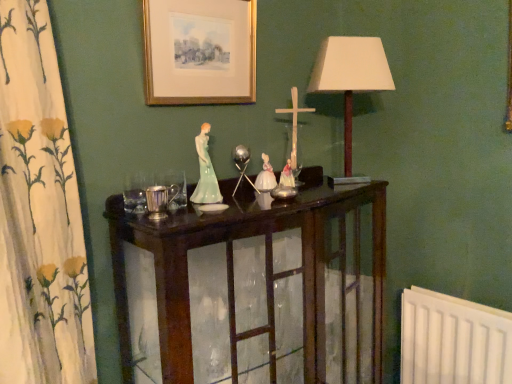
What is the approximate width of dark wood cabinet at center?

dark wood cabinet at center is 15.45 inches in width.

What is the approximate height of silver metallic candle holder at center?

3.18 inches.

Where is `gold-framed print at upper center`? gold-framed print at upper center is located at coordinates (200, 51).

This screenshot has height=384, width=512. Describe the element at coordinates (350, 76) in the screenshot. I see `white fabric lampshade at upper right` at that location.

In order to click on dark wood cabinet at center in this screenshot , I will do `click(265, 269)`.

Looking at their sizes, would you say gold-framed print at upper center is wider or thinner than dark wood cabinet at center?

Considering their sizes, gold-framed print at upper center looks slimmer than dark wood cabinet at center.

Are gold-framed print at upper center and dark wood cabinet at center located far from each other?

Actually, gold-framed print at upper center and dark wood cabinet at center are a little close together.

Is point (226, 39) closer or farther from the camera than point (186, 335)?

Point (226, 39) is positioned farther from the camera compared to point (186, 335).

Can you tell me how much gold-framed print at upper center and white fabric lampshade at upper right differ in facing direction?

They differ by 36 degrees in their facing directions.

Is gold-framed print at upper center inside the boundaries of white fabric lampshade at upper right, or outside?

gold-framed print at upper center is not inside white fabric lampshade at upper right, it's outside.

Is point (189, 40) more distant than point (385, 86)?

No.

From a real-world perspective, which object stands above the other?

gold-framed print at upper center is physically above.

Is dark wood cabinet at center not close to gold-framed print at upper center?

No, dark wood cabinet at center is in close proximity to gold-framed print at upper center.

Is dark wood cabinet at center oriented towards gold-framed print at upper center?

No, dark wood cabinet at center is not turned towards gold-framed print at upper center.

Can you confirm if dark wood cabinet at center is thinner than gold-framed print at upper center?

No, dark wood cabinet at center is not thinner than gold-framed print at upper center.

Consider the image. From the image's perspective, would you say dark wood cabinet at center is positioned over gold-framed print at upper center?

No, from the image's perspective, dark wood cabinet at center is not on top of gold-framed print at upper center.

Is point (377, 239) more distant than point (162, 214)?

That is True.

Considering the sizes of dark wood cabinet at center and silver metallic candle holder at center in the image, is dark wood cabinet at center bigger or smaller than silver metallic candle holder at center?

dark wood cabinet at center is bigger than silver metallic candle holder at center.

Based on the photo, between dark wood cabinet at center and silver metallic candle holder at center, which one appears on the left side from the viewer's perspective?

Positioned to the left is silver metallic candle holder at center.

Based on the photo, considering the sizes of dark wood cabinet at center and silver metallic candle holder at center in the image, is dark wood cabinet at center taller or shorter than silver metallic candle holder at center?

Considering their sizes, dark wood cabinet at center has more height than silver metallic candle holder at center.

How different are the orientations of silver metallic candle holder at center and gold-framed print at upper center in degrees?

The facing directions of silver metallic candle holder at center and gold-framed print at upper center are 0.589 degrees apart.

You are a GUI agent. You are given a task and a screenshot of the screen. Output one action in this format:
    pyautogui.click(x=<x>, y=<y>)
    Task: Click on the candle holder below the gold-framed print at upper center (from a real-world perspective)
    The height and width of the screenshot is (384, 512).
    Given the screenshot: What is the action you would take?
    pyautogui.click(x=160, y=200)

Is silver metallic candle holder at center bigger than gold-framed print at upper center?

No, silver metallic candle holder at center is not bigger than gold-framed print at upper center.

Is silver metallic candle holder at center in front of gold-framed print at upper center?

Yes, silver metallic candle holder at center is closer to the viewer.

Does gold-framed print at upper center turn towards silver metallic candle holder at center?

No, gold-framed print at upper center does not turn towards silver metallic candle holder at center.

In the scene shown: Would you say gold-framed print at upper center is inside or outside silver metallic candle holder at center?

gold-framed print at upper center cannot be found inside silver metallic candle holder at center.

Consider the image. From a real-world perspective, relative to gold-framed print at upper center, is white fabric lampshade at upper right vertically above or below?

In terms of real-world spatial position, white fabric lampshade at upper right is below gold-framed print at upper center.

Considering the sizes of objects white fabric lampshade at upper right and gold-framed print at upper center in the image provided, who is shorter, white fabric lampshade at upper right or gold-framed print at upper center?

With less height is gold-framed print at upper center.

Identify the location of table lamp behind the gold-framed print at upper center. The image size is (512, 384). (350, 76).

From the image's perspective, is white fabric lampshade at upper right on top of gold-framed print at upper center?

No, from the image's perspective, white fabric lampshade at upper right is not on top of gold-framed print at upper center.

I want to click on picture frame above the dark wood cabinet at center (from the image's perspective), so click(x=200, y=51).

Locate an element on the screen. The width and height of the screenshot is (512, 384). picture frame lying on the left of white fabric lampshade at upper right is located at coordinates (200, 51).

When comparing their distances from gold-framed print at upper center, does white fabric lampshade at upper right or silver metallic candle holder at center seem further?

silver metallic candle holder at center is further to gold-framed print at upper center.

Based on their spatial positions, is dark wood cabinet at center or silver metallic candle holder at center closer to gold-framed print at upper center?

silver metallic candle holder at center.

When comparing their distances from dark wood cabinet at center, does silver metallic candle holder at center or gold-framed print at upper center seem closer?

Among the two, silver metallic candle holder at center is located nearer to dark wood cabinet at center.

Based on their spatial positions, is dark wood cabinet at center or white fabric lampshade at upper right closer to gold-framed print at upper center?

Based on the image, white fabric lampshade at upper right appears to be nearer to gold-framed print at upper center.

Looking at this image, from the image, which object appears to be nearer to dark wood cabinet at center, gold-framed print at upper center or white fabric lampshade at upper right?

Based on the image, white fabric lampshade at upper right appears to be nearer to dark wood cabinet at center.

Considering their positions, is silver metallic candle holder at center positioned closer to dark wood cabinet at center than white fabric lampshade at upper right?

silver metallic candle holder at center lies closer to dark wood cabinet at center than the other object.

When comparing their distances from gold-framed print at upper center, does white fabric lampshade at upper right or dark wood cabinet at center seem further?

The object further to gold-framed print at upper center is dark wood cabinet at center.

Which object lies further to the anchor point dark wood cabinet at center, white fabric lampshade at upper right or gold-framed print at upper center?

The object further to dark wood cabinet at center is gold-framed print at upper center.

In order to click on picture frame situated between silver metallic candle holder at center and white fabric lampshade at upper right from left to right in this screenshot , I will do `click(200, 51)`.

What are the coordinates of `candle holder between white fabric lampshade at upper right and dark wood cabinet at center vertically` in the screenshot? It's located at (160, 200).

I want to click on candle holder between gold-framed print at upper center and dark wood cabinet at center in the vertical direction, so click(160, 200).

This screenshot has height=384, width=512. I want to click on table lamp between gold-framed print at upper center and dark wood cabinet at center in the up-down direction, so click(350, 76).